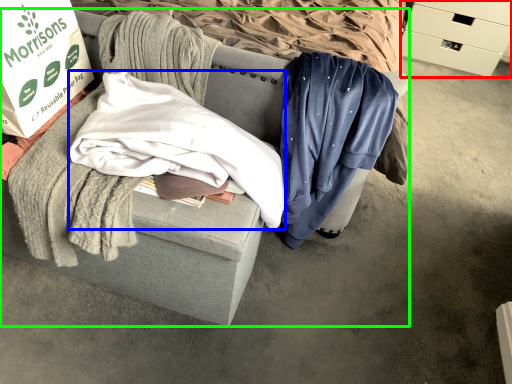
Question: Based on their relative distances, which object is farther from drawer (highlighted by a red box)? Choose from clothing (highlighted by a blue box) and furniture (highlighted by a green box).

Choices:
 (A) clothing
 (B) furniture

Answer: (B)